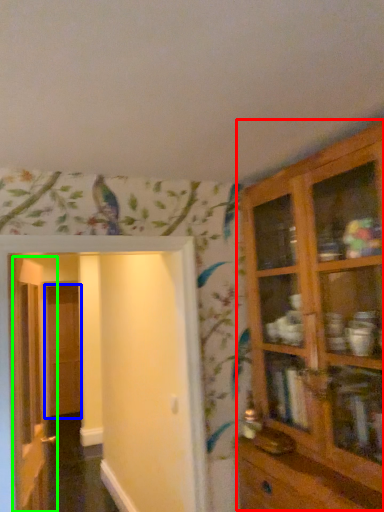
Question: Which object is the closest to the cupboard (highlighted by a red box)? Choose among these: door (highlighted by a blue box) or door (highlighted by a green box).

Choices:
 (A) door
 (B) door

Answer: (B)